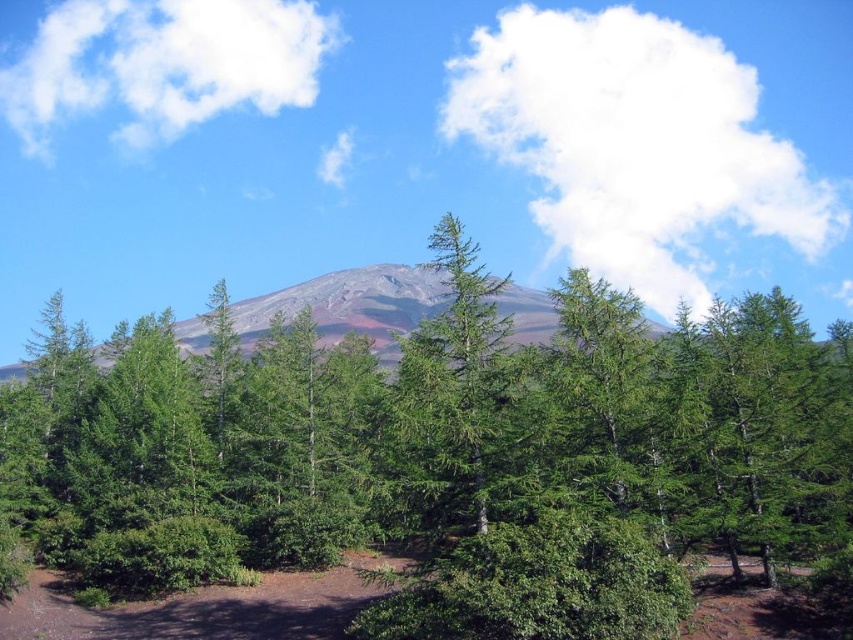
Based on the photo, you are standing in the forest and see the green matte tree at center and the matte gray mountain at center. Which object is closer to your left side?

The matte gray mountain at center is closer to your left side because the green matte tree at center is positioned on the right side of it.

You are a hiker planning to set up a tent between the green leafy trees at center and the green matte tree at center. Which tree has a wider base to provide more shade?

The green leafy trees at center are wider than the green matte tree at center, so they would provide more shade for the tent.